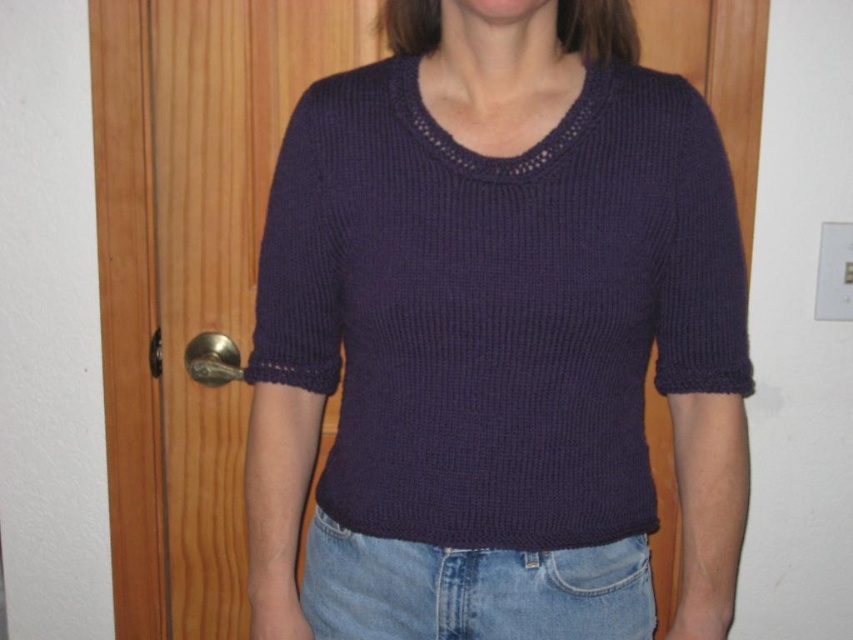
Is dark purple knit sweater at center smaller than denim at lower center?

No.

Is point (296, 506) behind point (442, 547)?

Yes.

Where is `dark purple knit sweater at center`? The width and height of the screenshot is (853, 640). dark purple knit sweater at center is located at coordinates (506, 308).